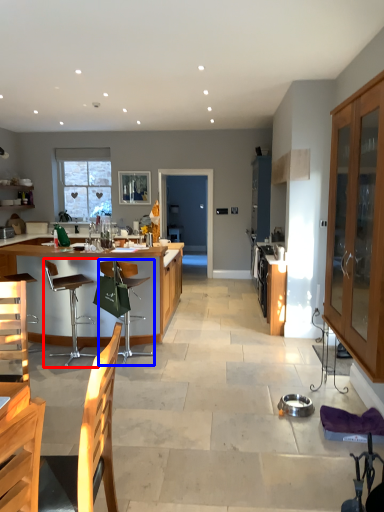
Question: Which object is further to the camera taking this photo, chair (highlighted by a red box) or chair (highlighted by a blue box)?

Choices:
 (A) chair
 (B) chair

Answer: (B)